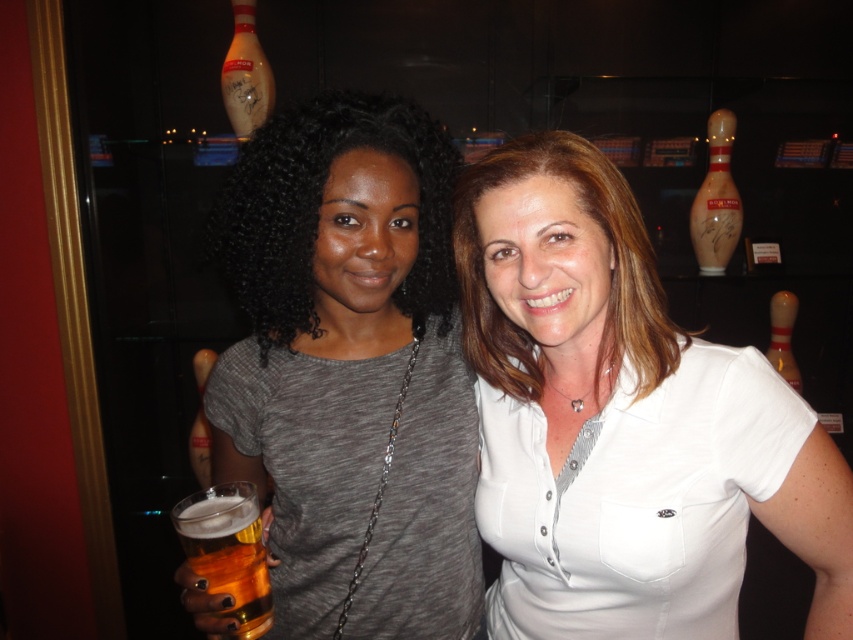
Describe the element at coordinates (621, 420) in the screenshot. The image size is (853, 640). I see `white glossy shirt at center` at that location.

Which of these two, white glossy shirt at center or golden amber liquid at lower left, stands shorter?

Standing shorter between the two is golden amber liquid at lower left.

This screenshot has width=853, height=640. What do you see at coordinates (621, 420) in the screenshot?
I see `white glossy shirt at center` at bounding box center [621, 420].

Where is `white glossy shirt at center`? Image resolution: width=853 pixels, height=640 pixels. white glossy shirt at center is located at coordinates (621, 420).

Can you confirm if gray heathered shirt at center is bigger than golden amber liquid at lower left?

Indeed, gray heathered shirt at center has a larger size compared to golden amber liquid at lower left.

Is point (289, 406) positioned after point (227, 532)?

Yes, it is behind point (227, 532).

Identify the location of gray heathered shirt at center. (350, 369).

This screenshot has width=853, height=640. In order to click on white glossy shirt at center in this screenshot , I will do `click(621, 420)`.

Who is more distant from viewer, [636,518] or [299,634]?

Positioned behind is point [299,634].

Image resolution: width=853 pixels, height=640 pixels. What do you see at coordinates (621, 420) in the screenshot? I see `white glossy shirt at center` at bounding box center [621, 420].

Image resolution: width=853 pixels, height=640 pixels. Identify the location of white glossy shirt at center. (621, 420).